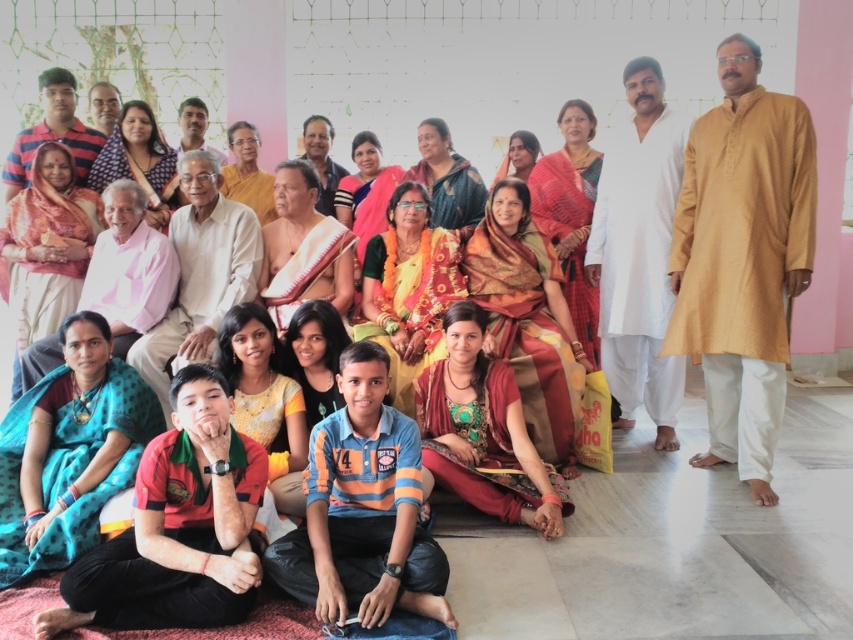
Question: Observing the image, what is the correct spatial positioning of matte orange saree at center in reference to yellow satin saree at center?

Choices:
 (A) above
 (B) below

Answer: (A)

Question: Is reddish-orange silk saree at center in front of matte orange saree at upper center?

Choices:
 (A) yes
 (B) no

Answer: (A)

Question: Based on their relative distances, which object is nearer to the matte orange saree at upper center?

Choices:
 (A) yellow satin saree at center
 (B) matte black shirt at center
 (C) matte pink saree at lower left

Answer: (B)

Question: Which object appears closest to the camera in this image?

Choices:
 (A) matte pink saree at lower left
 (B) matte pink saree at center
 (C) yellow satin saree at center
 (D) matte orange saree at center

Answer: (C)

Question: Is matte orange saree at center to the right of matte orange saree at upper center from the viewer's perspective?

Choices:
 (A) no
 (B) yes

Answer: (A)

Question: Which of these objects is positioned farthest from the matte orange saree at upper center?

Choices:
 (A) yellow satin saree at center
 (B) silky orange saree at center

Answer: (A)